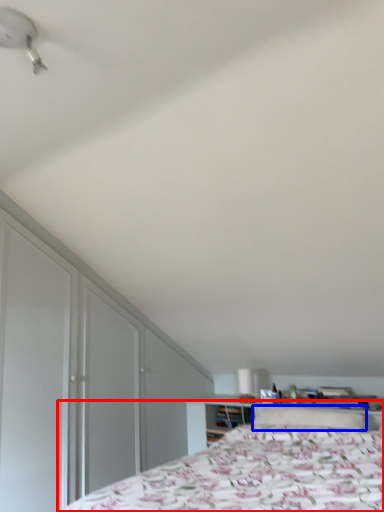
Question: Among these objects, which one is nearest to the camera, bed (highlighted by a red box) or pillow (highlighted by a blue box)?

Choices:
 (A) bed
 (B) pillow

Answer: (A)